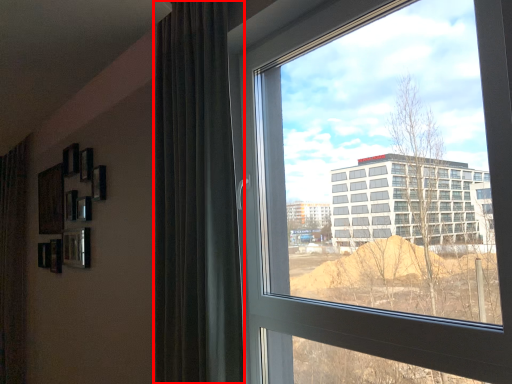
Question: From the image's perspective, what is the correct spatial relationship of curtain (annotated by the red box) in relation to window?

Choices:
 (A) below
 (B) above

Answer: (B)